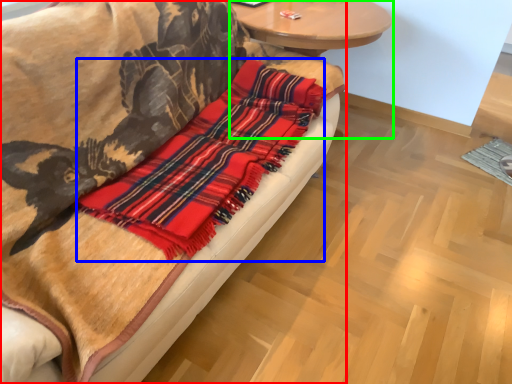
Question: Which object is positioned closest to studio couch (highlighted by a red box)? Select from flannel (highlighted by a blue box) and round table (highlighted by a green box).

Choices:
 (A) flannel
 (B) round table

Answer: (A)